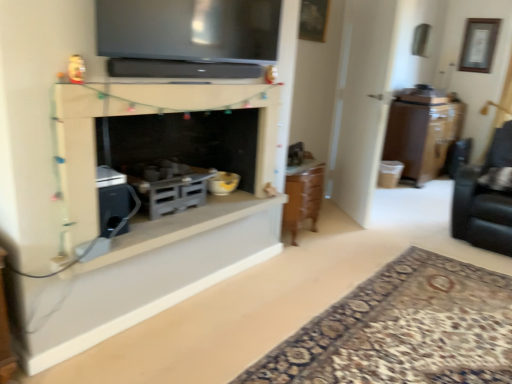
The width and height of the screenshot is (512, 384). What are the coordinates of `free space on the front side of white smooth baseboard at lower center, the first window sill from the bottom` in the screenshot? It's located at [x=181, y=339].